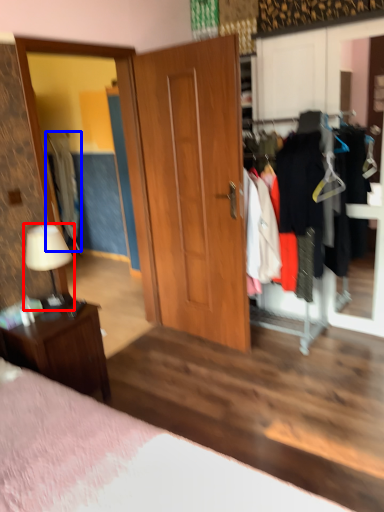
Question: Among these objects, which one is farthest to the camera, table lamp (highlighted by a red box) or clothing (highlighted by a blue box)?

Choices:
 (A) table lamp
 (B) clothing

Answer: (B)